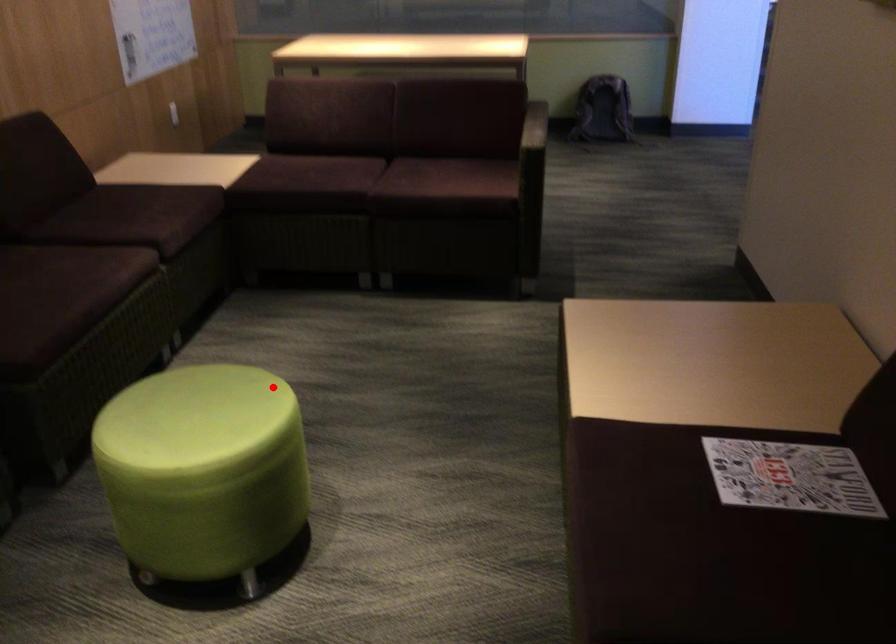
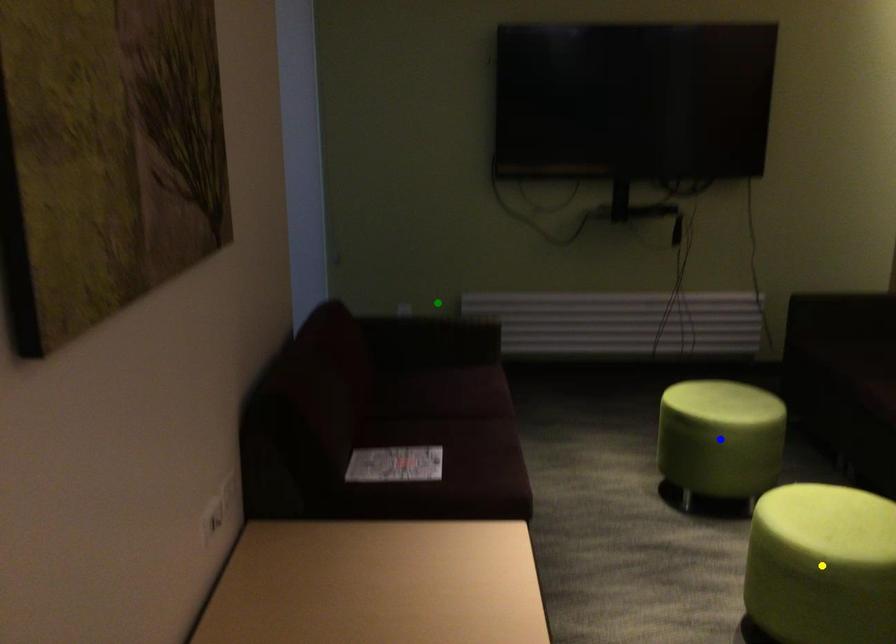
Question: I am providing you with two images of the same scene from different viewpoints. A red point is marked on the first image. You are given multiple points on the second image. Which point in image 2 represents the same 3d spot as the red point in image 1?

Choices:
 (A) yellow point
 (B) blue point
 (C) green point

Answer: (A)